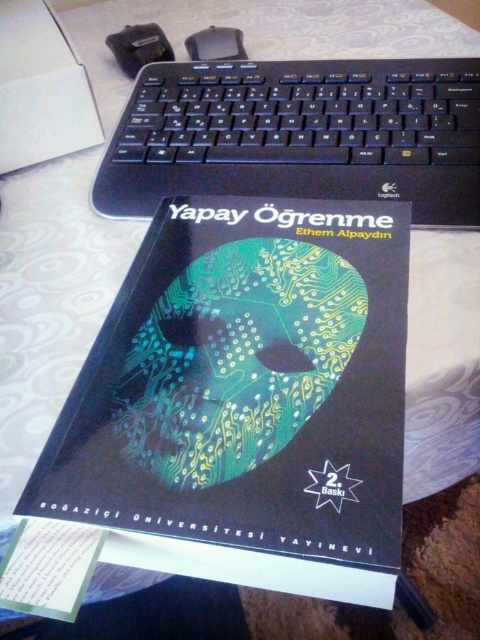
Is point (338, 467) more distant than point (205, 186)?

That is False.

Does green circuit board at center appear on the left side of black plastic keyboard at upper center?

Correct, you'll find green circuit board at center to the left of black plastic keyboard at upper center.

What do you see at coordinates (247, 401) in the screenshot? The height and width of the screenshot is (640, 480). I see `green circuit board at center` at bounding box center [247, 401].

Locate an element on the screen. green circuit board at center is located at coordinates (247, 401).